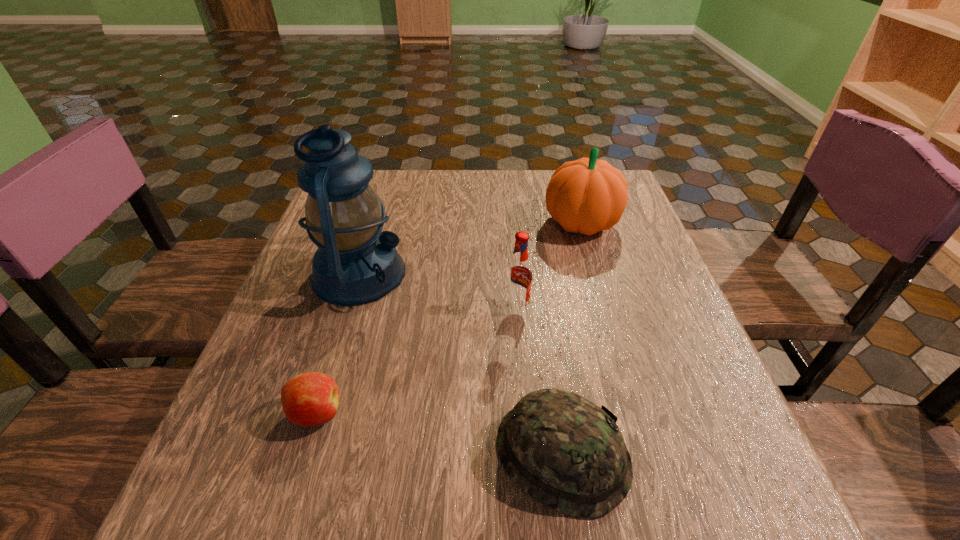
Locate an element on the screen. vacant space at the near right corner is located at coordinates (765, 483).

Locate an element on the screen. free space that is in between the pumpkin and the apple is located at coordinates (448, 318).

Where is `free space between the tallest object and the pumpkin`? This screenshot has width=960, height=540. free space between the tallest object and the pumpkin is located at coordinates (470, 248).

Identify the location of free space between the root beer and the apple. The height and width of the screenshot is (540, 960). (417, 361).

Locate an element on the screen. This screenshot has height=540, width=960. free space between the lantern and the apple is located at coordinates (338, 343).

Find the location of a particular element. Image resolution: width=960 pixels, height=540 pixels. free space between the pumpkin and the lantern is located at coordinates (470, 248).

Identify the location of vacant area that lies between the lantern and the apple. The image size is (960, 540). (338, 343).

This screenshot has height=540, width=960. I want to click on free spot between the shortest object and the second shortest object, so click(x=440, y=434).

The height and width of the screenshot is (540, 960). What are the coordinates of `empty space between the root beer and the headwear` in the screenshot? It's located at (540, 381).

Locate an element on the screen. free area in between the pumpkin and the headwear is located at coordinates (572, 339).